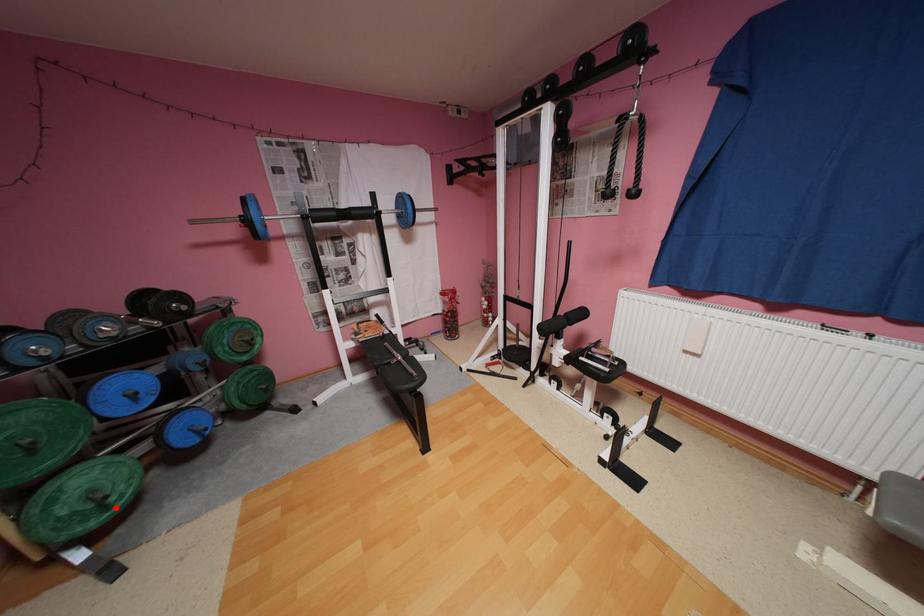
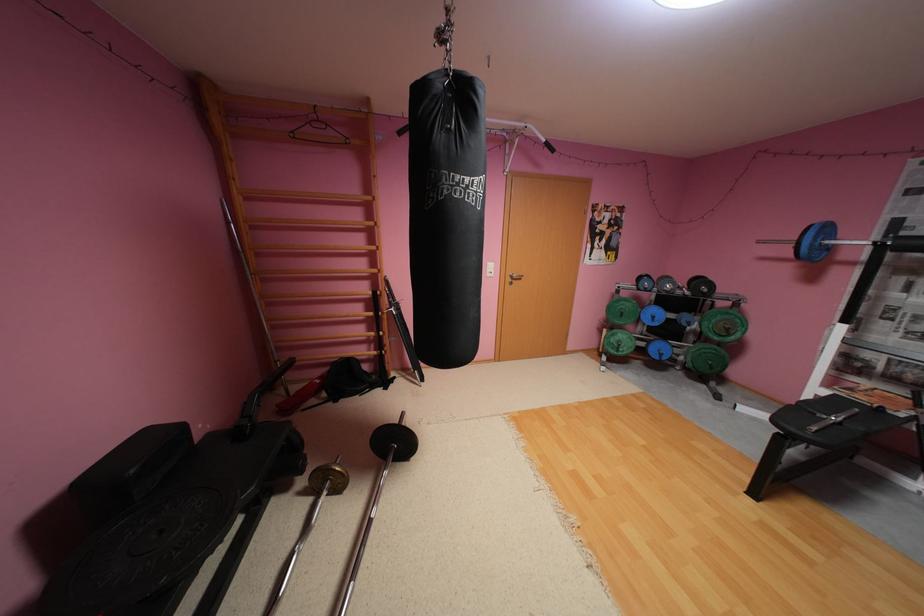
Find the pixel in the second image that matches the highlighted location in the first image.

(626, 351)